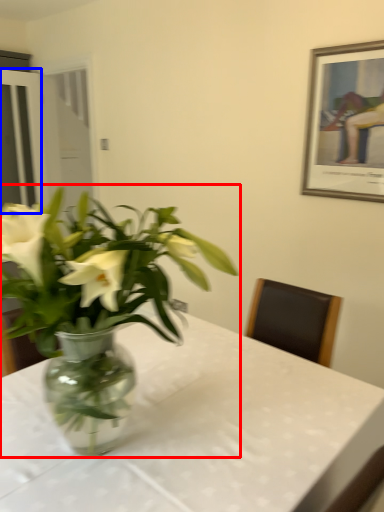
Question: Which point is closer to the camera, houseplant (highlighted by a red box) or glass door (highlighted by a blue box)?

Choices:
 (A) houseplant
 (B) glass door

Answer: (A)